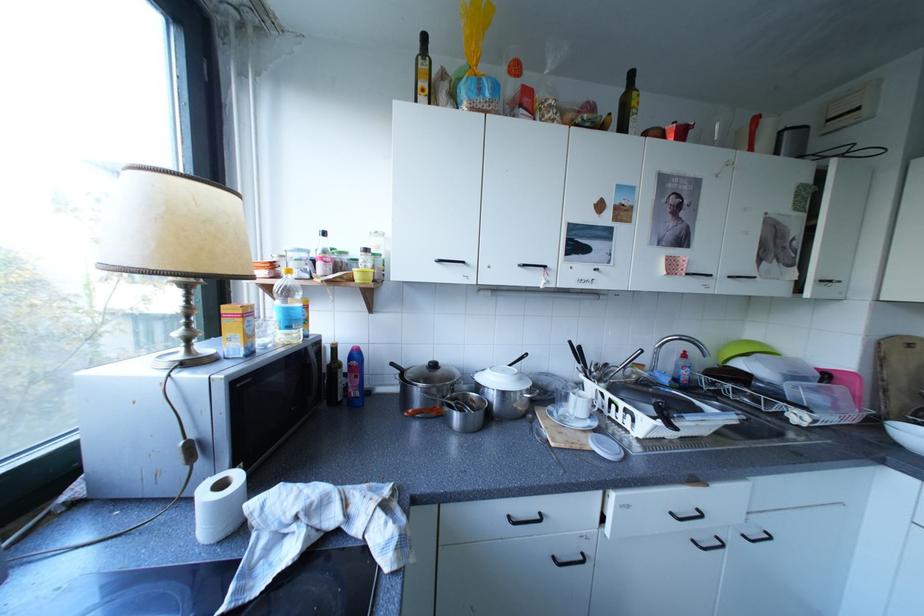
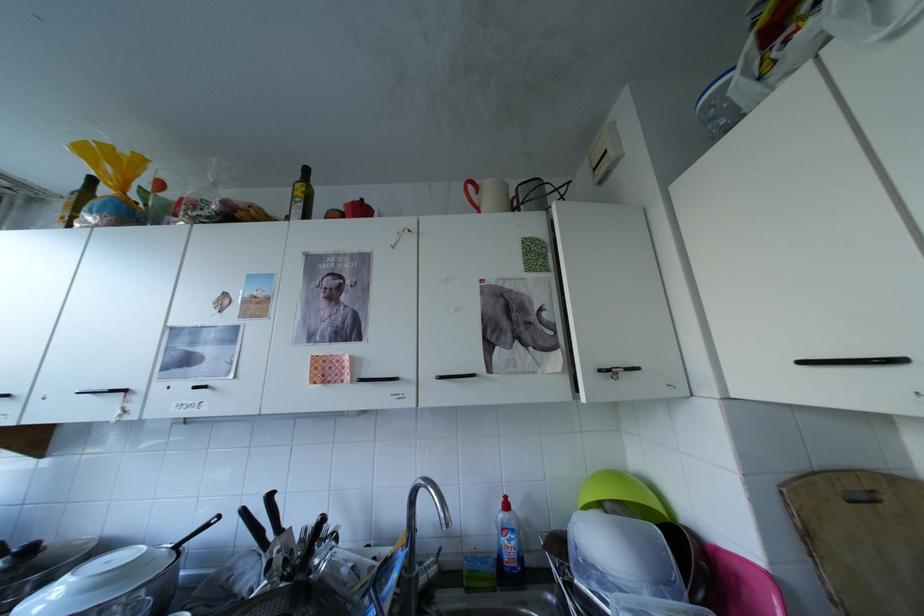
Where in the second image is the point corresponding to point (646, 103) from the first image?

(309, 193)